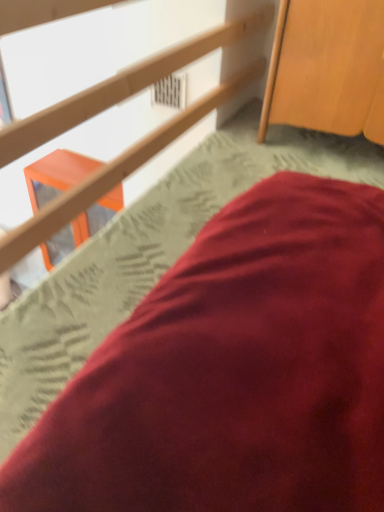
At what (x,y) coordinates should I click in order to perform the action: click on satin red pillow at lower right. Please return your answer as a coordinate pair (x, y). The height and width of the screenshot is (512, 384). Looking at the image, I should click on (233, 372).

Where is `matte wood rail at upper center`? The width and height of the screenshot is (384, 512). matte wood rail at upper center is located at coordinates (120, 87).

Considering the sizes of objects wooden cabinet at upper right and satin red pillow at lower right in the image provided, who is thinner, wooden cabinet at upper right or satin red pillow at lower right?

Thinner between the two is wooden cabinet at upper right.

Who is bigger, wooden cabinet at upper right or satin red pillow at lower right?

With larger size is wooden cabinet at upper right.

Considering the positions of points (278, 88) and (237, 381), is point (278, 88) farther from camera compared to point (237, 381)?

Yes, point (278, 88) is farther from viewer.

Could you tell me if satin red pillow at lower right is facing matte wood rail at upper center?

No, satin red pillow at lower right is not turned towards matte wood rail at upper center.

Looking at their sizes, would you say satin red pillow at lower right is wider or thinner than matte wood rail at upper center?

Considering their sizes, satin red pillow at lower right looks slimmer than matte wood rail at upper center.

Is satin red pillow at lower right positioned behind matte wood rail at upper center?

Yes.

From the image's perspective, which is above, matte wood rail at upper center or wooden cabinet at upper right?

From the image's view, wooden cabinet at upper right is above.

Which is correct: matte wood rail at upper center is inside wooden cabinet at upper right, or outside of it?

matte wood rail at upper center is not enclosed by wooden cabinet at upper right.

Considering the points (179, 118) and (278, 120), which point is behind, point (179, 118) or point (278, 120)?

The point (278, 120) is farther from the camera.

Can you confirm if satin red pillow at lower right is thinner than wooden cabinet at upper right?

No.

Do you think satin red pillow at lower right is within wooden cabinet at upper right, or outside of it?

The correct answer is: outside.

Between satin red pillow at lower right and wooden cabinet at upper right, which one appears on the left side from the viewer's perspective?

From the viewer's perspective, satin red pillow at lower right appears more on the left side.

What's the angular difference between satin red pillow at lower right and wooden cabinet at upper right's facing directions?

They differ by 88 degrees in their facing directions.

Is wooden cabinet at upper right in front of or behind matte wood rail at upper center in the image?

wooden cabinet at upper right is behind matte wood rail at upper center.

Is wooden cabinet at upper right to the left of matte wood rail at upper center from the viewer's perspective?

No, wooden cabinet at upper right is not to the left of matte wood rail at upper center.

Is the surface of wooden cabinet at upper right in direct contact with matte wood rail at upper center?

No, wooden cabinet at upper right is not making contact with matte wood rail at upper center.

In the scene shown: From a real-world perspective, is wooden cabinet at upper right physically below matte wood rail at upper center?

Indeed, from a real-world perspective, wooden cabinet at upper right is positioned beneath matte wood rail at upper center.

You are a GUI agent. You are given a task and a screenshot of the screen. Output one action in this format:
    pyautogui.click(x=<x>, y=<y>)
    Task: Click on the bed lying behind the matte wood rail at upper center
    This screenshot has width=384, height=512.
    Given the screenshot: What is the action you would take?
    pyautogui.click(x=233, y=372)

Is satin red pillow at lower right at the back of matte wood rail at upper center?

matte wood rail at upper center is not turned away from satin red pillow at lower right.

Can you confirm if matte wood rail at upper center is bigger than satin red pillow at lower right?

Indeed, matte wood rail at upper center has a larger size compared to satin red pillow at lower right.

Can you tell me how much matte wood rail at upper center and satin red pillow at lower right differ in facing direction?

They differ by 88.4 degrees in their facing directions.

Locate an element on the screen. bed on the left of wooden cabinet at upper right is located at coordinates (233, 372).

Find the location of a particular element. Image resolution: width=384 pixels, height=512 pixels. rail above the satin red pillow at lower right (from the image's perspective) is located at coordinates (120, 87).

Considering their positions, is matte wood rail at upper center positioned closer to satin red pillow at lower right than wooden cabinet at upper right?

matte wood rail at upper center.

When comparing their distances from matte wood rail at upper center, does wooden cabinet at upper right or satin red pillow at lower right seem further?

satin red pillow at lower right is further to matte wood rail at upper center.

Looking at the image, which one is located closer to wooden cabinet at upper right, matte wood rail at upper center or satin red pillow at lower right?

matte wood rail at upper center is closer to wooden cabinet at upper right.

When comparing their distances from matte wood rail at upper center, does satin red pillow at lower right or wooden cabinet at upper right seem closer?

Based on the image, wooden cabinet at upper right appears to be nearer to matte wood rail at upper center.

From the image, which object appears to be farther from satin red pillow at lower right, wooden cabinet at upper right or matte wood rail at upper center?

Among the two, wooden cabinet at upper right is located further to satin red pillow at lower right.

Based on the photo, which object lies further to the anchor point wooden cabinet at upper right, satin red pillow at lower right or matte wood rail at upper center?

satin red pillow at lower right.

Locate an element on the screen. bed positioned between matte wood rail at upper center and wooden cabinet at upper right from near to far is located at coordinates (233, 372).